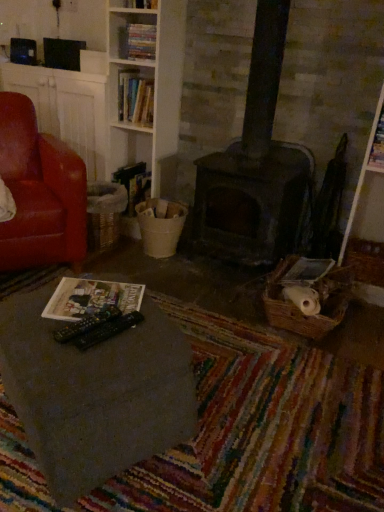
Question: Is hardcover book at center, placed as the third book when sorted from top to bottom, looking in the opposite direction of smooth gray table at lower left?

Choices:
 (A) yes
 (B) no

Answer: (B)

Question: Is hardcover book at center, placed as the 1th book when sorted from bottom to top, to the right of smooth gray table at lower left from the viewer's perspective?

Choices:
 (A) no
 (B) yes

Answer: (A)

Question: From a real-world perspective, is hardcover book at center, placed as the 1th book when sorted from bottom to top, below smooth gray table at lower left?

Choices:
 (A) yes
 (B) no

Answer: (B)

Question: Is hardcover book at center, placed as the 1th book when sorted from bottom to top, closer to camera compared to smooth gray table at lower left?

Choices:
 (A) no
 (B) yes

Answer: (A)

Question: Is hardcover book at center, placed as the third book when sorted from top to bottom, aimed at smooth gray table at lower left?

Choices:
 (A) yes
 (B) no

Answer: (B)

Question: Can you confirm if hardcover book at center, placed as the third book when sorted from top to bottom, is wider than smooth gray table at lower left?

Choices:
 (A) no
 (B) yes

Answer: (A)

Question: Can you confirm if hardcover book at upper center, which is the second book in top-to-bottom order, is taller than leather at left?

Choices:
 (A) yes
 (B) no

Answer: (B)

Question: Is hardcover book at upper center, the second book in the bottom-to-top sequence, not within leather at left?

Choices:
 (A) yes
 (B) no

Answer: (A)

Question: From a real-world perspective, is hardcover book at upper center, the second book in the bottom-to-top sequence, located higher than leather at left?

Choices:
 (A) no
 (B) yes

Answer: (B)

Question: Does hardcover book at upper center, which is the second book in top-to-bottom order, contain leather at left?

Choices:
 (A) yes
 (B) no

Answer: (B)

Question: Does hardcover book at upper center, which is the second book in top-to-bottom order, have a lesser height compared to leather at left?

Choices:
 (A) yes
 (B) no

Answer: (A)

Question: From the image's perspective, does hardcover book at upper center, which is the second book in top-to-bottom order, appear higher than leather at left?

Choices:
 (A) no
 (B) yes

Answer: (B)

Question: From the image's perspective, is matte paper magazine at lower left, positioned as the second magazine in top-to-bottom order, on matte paper magazine at upper right, the 2th magazine positioned from the bottom?

Choices:
 (A) no
 (B) yes

Answer: (A)